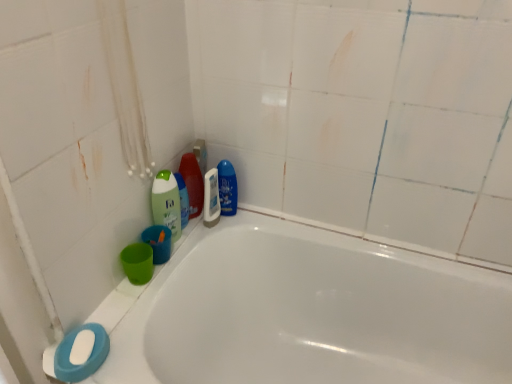
Where is `empty space that is to the right of white glossy mouthwash at center`? The height and width of the screenshot is (384, 512). empty space that is to the right of white glossy mouthwash at center is located at coordinates (257, 224).